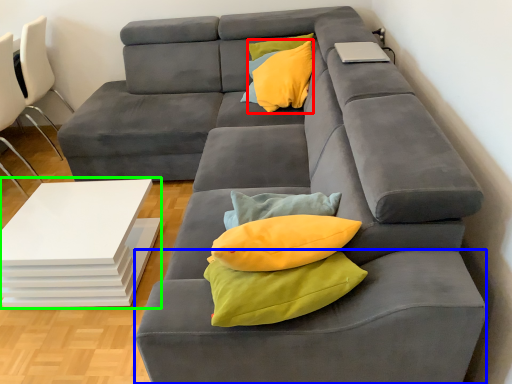
Question: Considering the real-world distances, which object is farthest from throw pillow (highlighted by a red box)? footrest (highlighted by a blue box) or table (highlighted by a green box)?

Choices:
 (A) footrest
 (B) table

Answer: (A)